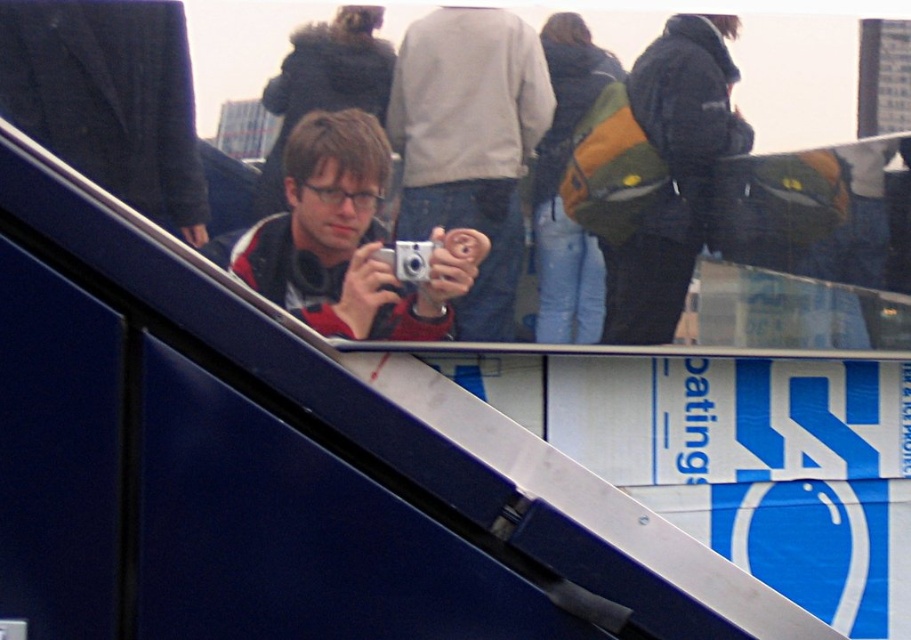
Who is more forward, [441,52] or [397,256]?

Positioned in front is point [441,52].

Which of these two, matte gray sweater at center or silver metallic camera at center, stands taller?

matte gray sweater at center

Which is behind, point (523, 52) or point (415, 282)?

The point (523, 52) is more distant.

Identify the location of matte gray sweater at center. This screenshot has width=911, height=640. (469, 144).

Can you confirm if matte black camera at center is positioned above silver metallic camera at center?

Yes.

Identify the location of matte black camera at center. (347, 241).

Is point (387, 145) positioned behind point (420, 266)?

No.

You are a GUI agent. You are given a task and a screenshot of the screen. Output one action in this format:
    pyautogui.click(x=<x>, y=<y>)
    Task: Click on the matte black camera at center
    This screenshot has height=640, width=911.
    Given the screenshot: What is the action you would take?
    pyautogui.click(x=347, y=241)

Does dark blue jacket at upper right appear under silver metallic camera at center?

Incorrect, dark blue jacket at upper right is not positioned below silver metallic camera at center.

Does dark blue jacket at upper right have a greater width compared to silver metallic camera at center?

Correct, the width of dark blue jacket at upper right exceeds that of silver metallic camera at center.

This screenshot has height=640, width=911. What do you see at coordinates (673, 172) in the screenshot? I see `dark blue jacket at upper right` at bounding box center [673, 172].

The height and width of the screenshot is (640, 911). Identify the location of dark blue jacket at upper right. (673, 172).